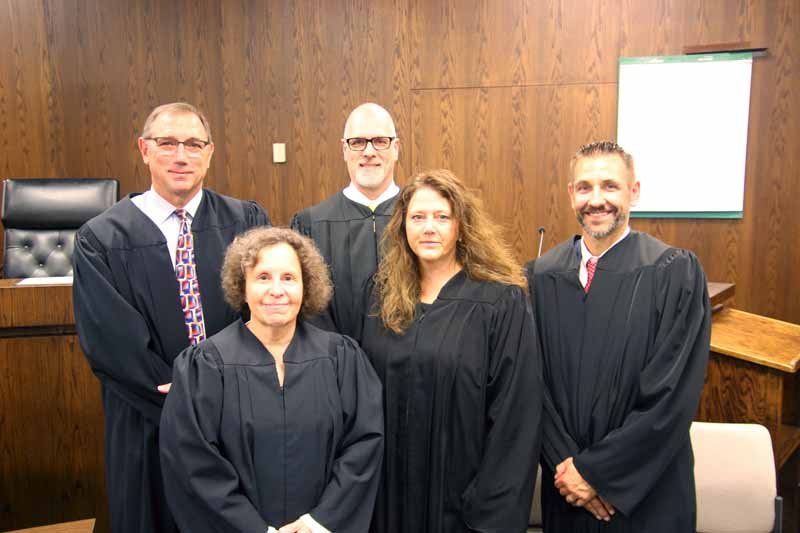
The height and width of the screenshot is (533, 800). I want to click on robes, so click(618, 372), click(506, 377), click(370, 260), click(309, 354), click(148, 290).